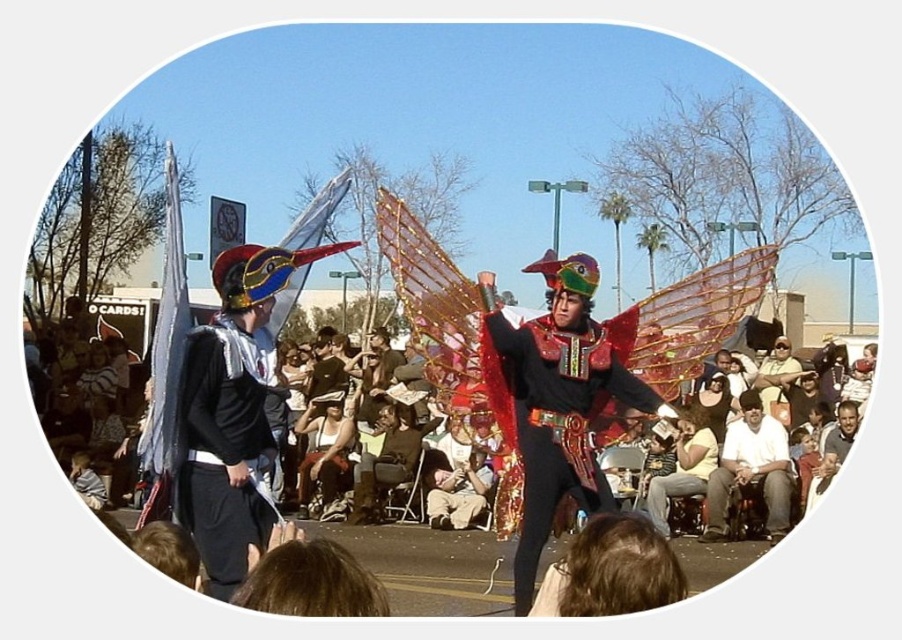
Question: Is shiny metallic wings at center closer to camera compared to white cotton shirt at lower right?

Choices:
 (A) no
 (B) yes

Answer: (B)

Question: Which object appears farthest from the camera in this image?

Choices:
 (A) white cotton shirt at lower right
 (B) matte black cape at center
 (C) shiny metallic wings at center

Answer: (A)

Question: Can you confirm if shiny metallic wings at center is bigger than matte black cape at center?

Choices:
 (A) no
 (B) yes

Answer: (B)

Question: Among these points, which one is nearest to the camera?

Choices:
 (A) (247, 323)
 (B) (783, 429)

Answer: (A)

Question: Which point is farther to the camera?

Choices:
 (A) (770, 456)
 (B) (517, 577)

Answer: (A)

Question: Does shiny metallic wings at center have a smaller size compared to matte black cape at center?

Choices:
 (A) no
 (B) yes

Answer: (A)